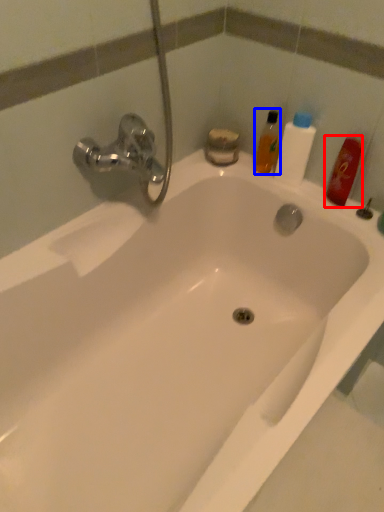
Question: Which of the following is the closest to the observer, mouthwash (highlighted by a red box) or mouthwash (highlighted by a blue box)?

Choices:
 (A) mouthwash
 (B) mouthwash

Answer: (A)